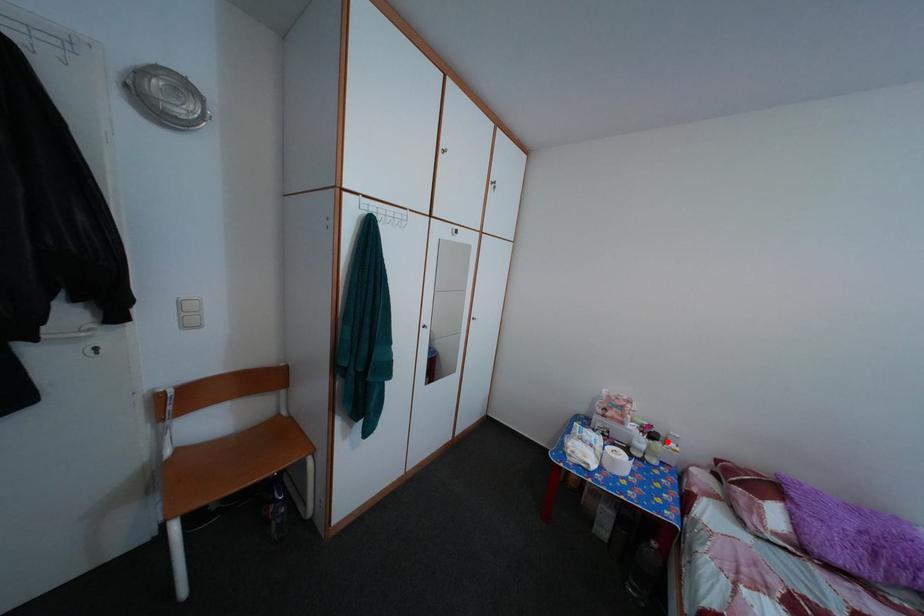
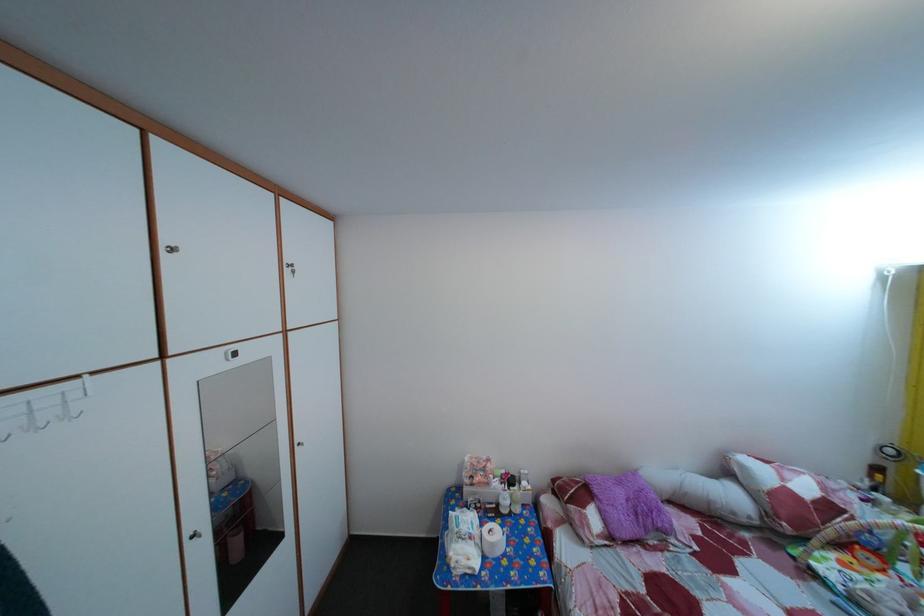
Where in the second image is the point corresponding to the highlighted location from the first image?

(524, 485)